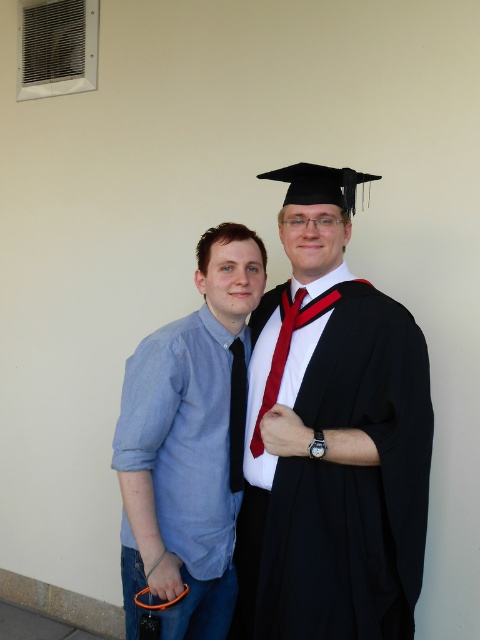
Does blue cotton shirt at left have a greater height compared to shiny silk tie at center?

Correct, blue cotton shirt at left is much taller as shiny silk tie at center.

Locate an element on the screen. This screenshot has height=640, width=480. blue cotton shirt at left is located at coordinates (189, 444).

Where is `matte black graduation gown at center`? matte black graduation gown at center is located at coordinates (331, 438).

Can you confirm if matte black graduation gown at center is positioned above blue cotton shirt at left?

Correct, matte black graduation gown at center is located above blue cotton shirt at left.

Is point (355, 438) positioned behind point (139, 509)?

That is False.

What are the coordinates of `matte black graduation gown at center` in the screenshot? It's located at (331, 438).

From the picture: Between matte black graduation gown at center and shiny silk tie at center, which one appears on the right side from the viewer's perspective?

matte black graduation gown at center is more to the right.

Between matte black graduation gown at center and shiny silk tie at center, which one is positioned higher?

shiny silk tie at center is above.

Locate an element on the screen. The width and height of the screenshot is (480, 640). matte black graduation gown at center is located at coordinates (331, 438).

At what (x,y) coordinates should I click in order to perform the action: click on matte black graduation gown at center. Please return your answer as a coordinate pair (x, y). This screenshot has width=480, height=640. Looking at the image, I should click on (331, 438).